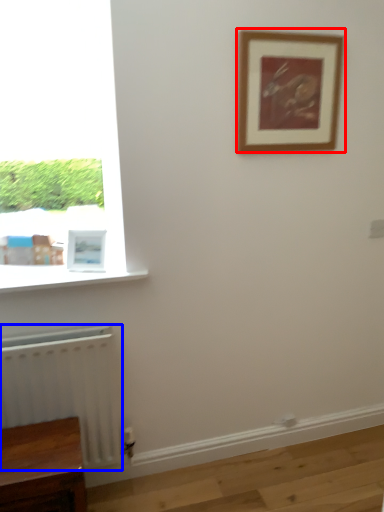
Question: Among these objects, which one is farthest to the camera, picture frame (highlighted by a red box) or radiator (highlighted by a blue box)?

Choices:
 (A) picture frame
 (B) radiator

Answer: (A)